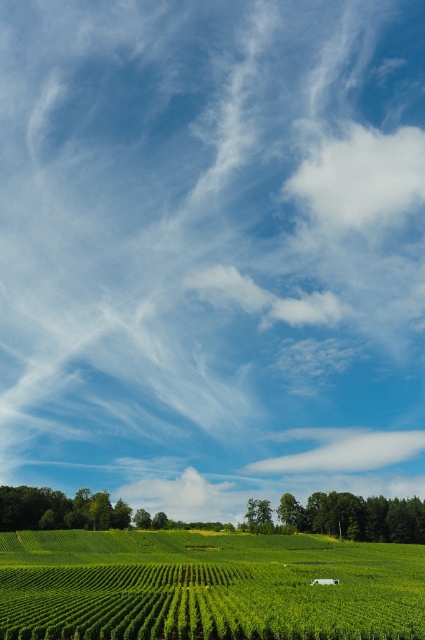
Does white cotton cloud at upper center appear on the right side of white fluffy cloud at center?

Yes, white cotton cloud at upper center is to the right of white fluffy cloud at center.

Is white cotton cloud at upper center taller than white fluffy cloud at center?

In fact, white cotton cloud at upper center may be shorter than white fluffy cloud at center.

At what (x,y) coordinates should I click in order to perform the action: click on white cotton cloud at upper center. Please return your answer as a coordinate pair (x, y). Image resolution: width=425 pixels, height=640 pixels. Looking at the image, I should click on (342, 449).

Find the location of a particular element. This screenshot has height=640, width=425. white cotton cloud at upper center is located at coordinates (342, 449).

Can you confirm if green leafy field at lower center is bigger than white fluffy cloud at upper center?

Yes.

Can you confirm if green leafy field at lower center is thinner than white fluffy cloud at upper center?

No, green leafy field at lower center is not thinner than white fluffy cloud at upper center.

At what (x,y) coordinates should I click in order to perform the action: click on green leafy field at lower center. Please return your answer as a coordinate pair (x, y). Image resolution: width=425 pixels, height=640 pixels. Looking at the image, I should click on (206, 586).

The image size is (425, 640). What are the coordinates of `green leafy field at lower center` in the screenshot? It's located at (206, 586).

Between green leafy trees at center and white cotton cloud at upper center, which one has less height?

green leafy trees at center

Which is in front, point (410, 520) or point (418, 451)?

Point (410, 520) is more forward.

Is point (413, 504) positioned after point (320, 465)?

No.

The width and height of the screenshot is (425, 640). What are the coordinates of `green leafy trees at center` in the screenshot? It's located at (357, 516).